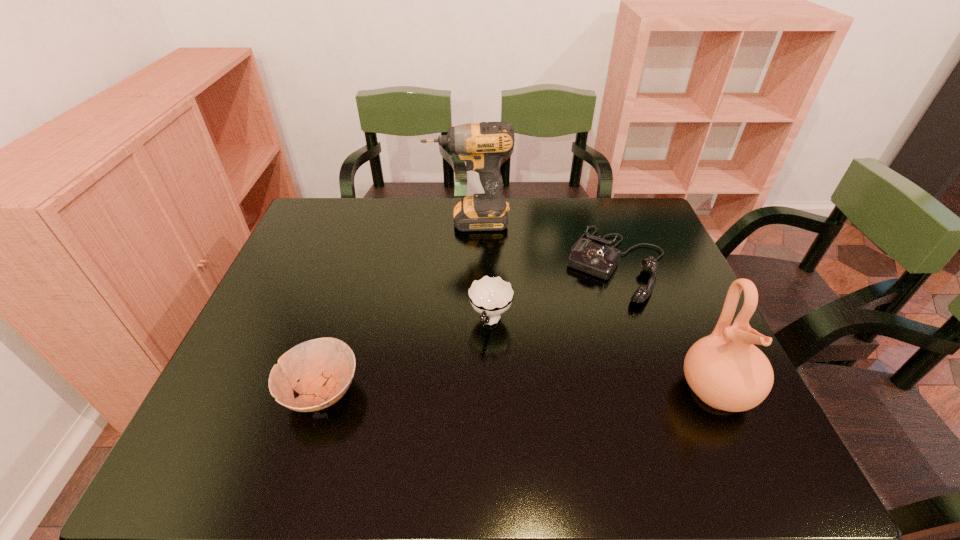
Locate an element on the screen. This screenshot has height=540, width=960. vacant point at the far left corner is located at coordinates (310, 236).

This screenshot has height=540, width=960. In the image, there is a desktop. What are the coordinates of `vacant space at the near left corner` in the screenshot? It's located at (239, 402).

Image resolution: width=960 pixels, height=540 pixels. I want to click on vacant region at the far right corner of the desktop, so click(646, 221).

Find the location of a particular element. This screenshot has width=960, height=540. empty location between the drill and the bowl is located at coordinates (396, 307).

At what (x,y) coordinates should I click in order to perform the action: click on free space between the telephone and the second tallest object. Please return your answer as a coordinate pair (x, y). Looking at the image, I should click on (666, 327).

Find the location of a particular element. The width and height of the screenshot is (960, 540). vacant space that's between the shortest object and the drill is located at coordinates (396, 307).

Image resolution: width=960 pixels, height=540 pixels. Find the location of `vacant area that lies between the telephone and the pottery`. vacant area that lies between the telephone and the pottery is located at coordinates (666, 327).

Where is `free spot between the telephone and the cup`? The image size is (960, 540). free spot between the telephone and the cup is located at coordinates (554, 293).

You are a GUI agent. You are given a task and a screenshot of the screen. Output one action in this format:
    pyautogui.click(x=<x>, y=<y>)
    Task: Click on the vacant space that is in between the telephone and the cup
    The width and height of the screenshot is (960, 540).
    Given the screenshot: What is the action you would take?
    pyautogui.click(x=554, y=293)

You are a GUI agent. You are given a task and a screenshot of the screen. Output one action in this format:
    pyautogui.click(x=<x>, y=<y>)
    Task: Click on the free space between the drill and the telephone
    
    Given the screenshot: What is the action you would take?
    pyautogui.click(x=543, y=242)